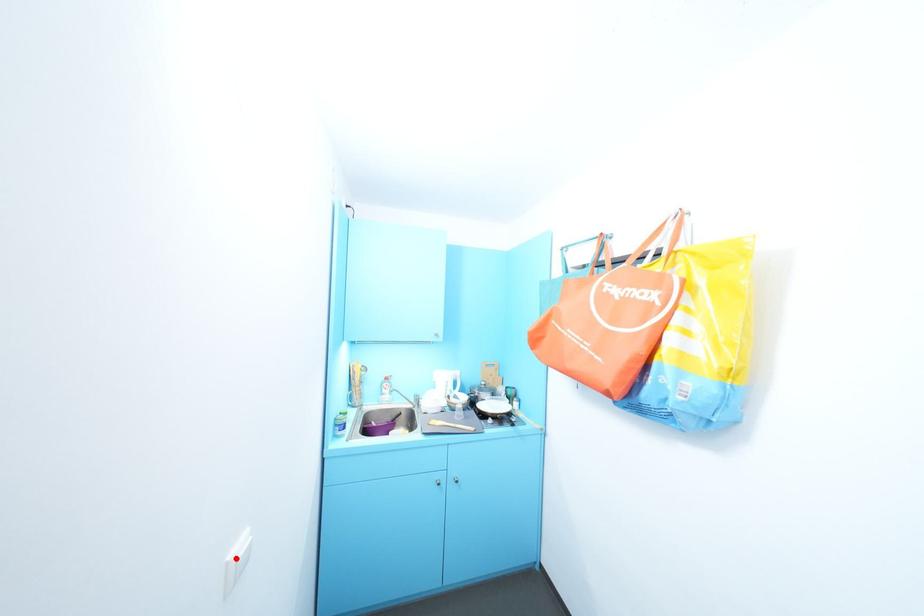
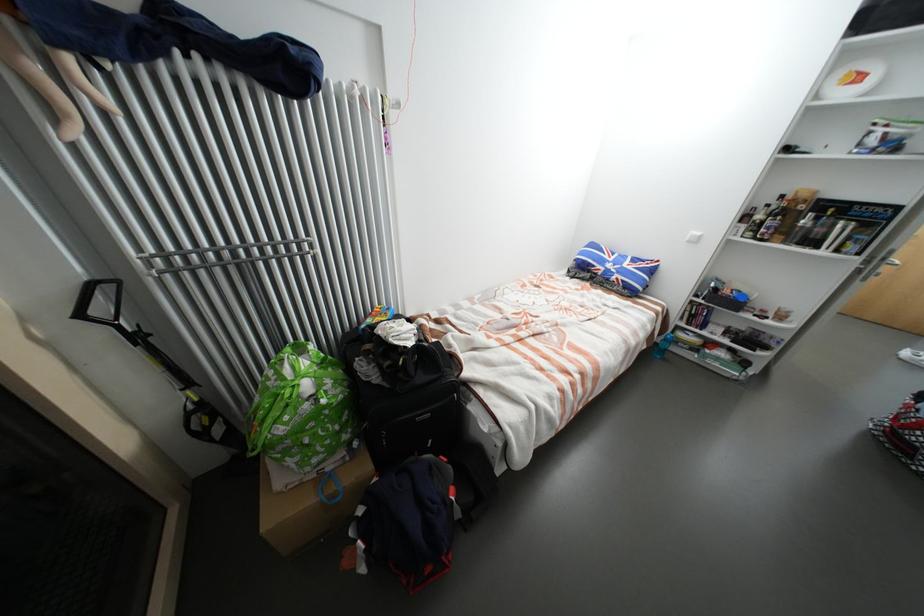
Question: I am providing you with two images of the same scene from different viewpoints. A red point is marked on the first image. Can you still see the location of the red point in image 2?

Choices:
 (A) Yes
 (B) No

Answer: (B)